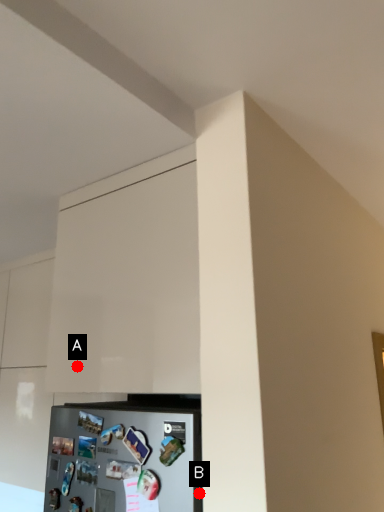
Question: Two points are circled on the image, labeled by A and B beside each circle. Which point is further to the camera?

Choices:
 (A) A is further
 (B) B is further

Answer: (A)